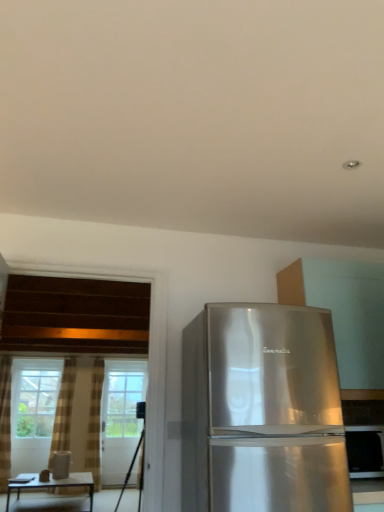
Question: From a real-world perspective, is black matte tripod at lower left located beneath plaid fabric curtain at left, acting as the 2th curtain starting from the left?

Choices:
 (A) yes
 (B) no

Answer: (A)

Question: Can you confirm if black matte tripod at lower left is wider than plaid fabric curtain at left, acting as the 2th curtain starting from the left?

Choices:
 (A) no
 (B) yes

Answer: (B)

Question: Considering the relative positions of black matte tripod at lower left and plaid fabric curtain at left, arranged as the first curtain when viewed from the right, in the image provided, is black matte tripod at lower left in front of plaid fabric curtain at left, arranged as the first curtain when viewed from the right,?

Choices:
 (A) no
 (B) yes

Answer: (B)

Question: From the image's perspective, is black matte tripod at lower left below plaid fabric curtain at left, arranged as the first curtain when viewed from the right?

Choices:
 (A) yes
 (B) no

Answer: (B)

Question: Is black matte tripod at lower left thinner than plaid fabric curtain at left, acting as the 2th curtain starting from the left?

Choices:
 (A) no
 (B) yes

Answer: (A)

Question: From a real-world perspective, is black matte tripod at lower left physically above plaid fabric curtain at left, acting as the 2th curtain starting from the left?

Choices:
 (A) yes
 (B) no

Answer: (B)

Question: Considering the relative sizes of brown textured curtain at left, which is counted as the first curtain, starting from the left, and satin silver refrigerator at right in the image provided, is brown textured curtain at left, which is counted as the first curtain, starting from the left, shorter than satin silver refrigerator at right?

Choices:
 (A) yes
 (B) no

Answer: (B)

Question: Is satin silver refrigerator at right surrounded by brown textured curtain at left, marked as the 2th curtain in a right-to-left arrangement?

Choices:
 (A) yes
 (B) no

Answer: (B)

Question: Can you confirm if brown textured curtain at left, marked as the 2th curtain in a right-to-left arrangement, is positioned to the right of satin silver refrigerator at right?

Choices:
 (A) no
 (B) yes

Answer: (A)

Question: From the image's perspective, would you say brown textured curtain at left, marked as the 2th curtain in a right-to-left arrangement, is positioned over satin silver refrigerator at right?

Choices:
 (A) no
 (B) yes

Answer: (A)

Question: From a real-world perspective, is brown textured curtain at left, marked as the 2th curtain in a right-to-left arrangement, physically below satin silver refrigerator at right?

Choices:
 (A) no
 (B) yes

Answer: (A)

Question: Considering the relative sizes of satin silver refrigerator at right and brown textured curtain at left, which is counted as the first curtain, starting from the left, in the image provided, is satin silver refrigerator at right taller than brown textured curtain at left, which is counted as the first curtain, starting from the left,?

Choices:
 (A) yes
 (B) no

Answer: (B)